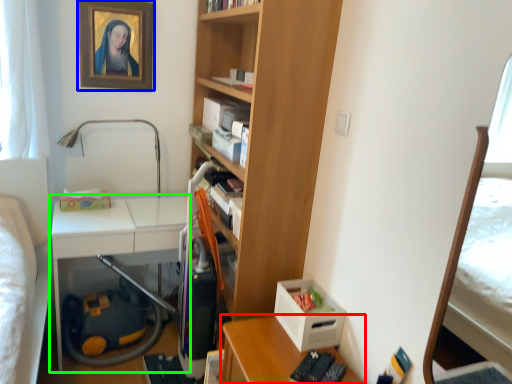
Question: Which object is positioned farthest from desk (highlighted by a red box)? Select from picture frame (highlighted by a blue box) and table (highlighted by a green box).

Choices:
 (A) picture frame
 (B) table

Answer: (A)